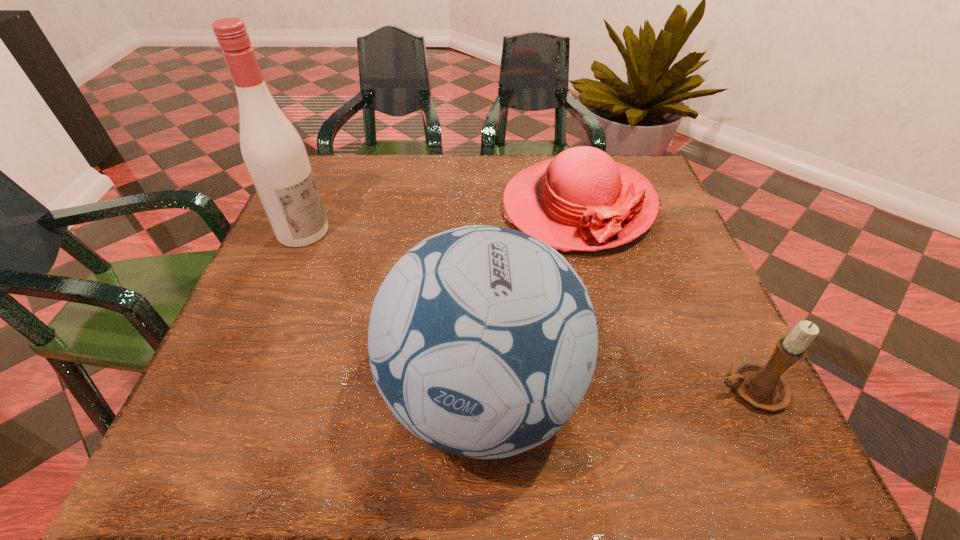
At what (x,y) coordinates should I click in order to perform the action: click on vacant space that satisfies the following two spatial constraints: 1. on the front side of the shortest object; 2. on the side of the candle holder with the handle. Please return your answer as a coordinate pair (x, y). Looking at the image, I should click on (624, 389).